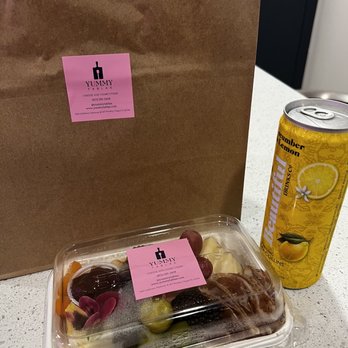
At what (x,y) coordinates should I click in order to perform the action: click on plastic container. Please return your answer as a coordinate pair (x, y). Image resolution: width=348 pixels, height=348 pixels. Looking at the image, I should click on (203, 323).